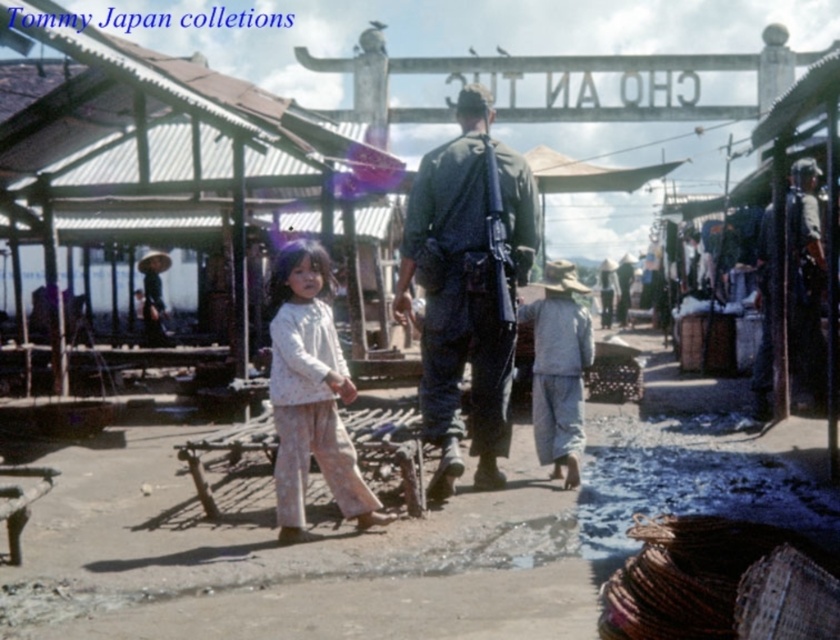
Question: Can you confirm if dark green uniform at center is positioned to the left of white floral dress at center?

Choices:
 (A) yes
 (B) no

Answer: (B)

Question: Is dark green uniform at center to the right of white floral dress at center from the viewer's perspective?

Choices:
 (A) no
 (B) yes

Answer: (B)

Question: Which point is closer to the camera?

Choices:
 (A) (315, 381)
 (B) (576, 452)

Answer: (A)

Question: Based on their relative distances, which object is nearer to the dark green uniform at center?

Choices:
 (A) white floral dress at center
 (B) gray cotton hat at center

Answer: (A)

Question: Which point is farther to the camera?

Choices:
 (A) dark green uniform at center
 (B) gray cotton hat at center
 (C) white floral dress at center

Answer: (B)

Question: Does dark green uniform at center have a smaller size compared to white floral dress at center?

Choices:
 (A) yes
 (B) no

Answer: (A)